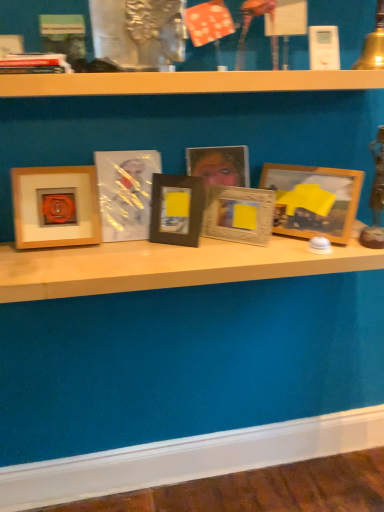
Question: In terms of width, does wooden picture frame at center, the 2th picture frame when ordered from right to left, look wider or thinner when compared to black matte picture frame at center, which ranks as the third picture frame in left-to-right order?

Choices:
 (A) wide
 (B) thin

Answer: (B)

Question: Would you say wooden picture frame at center, the 2th picture frame when ordered from right to left, is inside or outside black matte picture frame at center, which is the 4th picture frame in right-to-left order?

Choices:
 (A) outside
 (B) inside

Answer: (A)

Question: Based on their relative distances, which object is nearer to the wooden picture frame at center, the 2th picture frame when ordered from right to left?

Choices:
 (A) wooden photo frame at center, the 3th picture frame in the right-to-left sequence
 (B) matte wood picture frame at left, the sixth picture frame when ordered from right to left
 (C) matte plastic picture frame at center, the fifth picture frame from the right
 (D) wooden shelf at center
 (E) wooden frame at center, which is the 6th picture frame in left-to-right order

Answer: (A)

Question: Estimate the real-world distances between objects in this image. Which object is closer to the wooden shelf at upper center?

Choices:
 (A) wooden frame at center, which is the 6th picture frame in left-to-right order
 (B) hardcover book at upper left
 (C) black matte picture frame at center, which ranks as the third picture frame in left-to-right order
 (D) matte wood picture frame at left, marked as the first picture frame in a left-to-right arrangement
 (E) wooden picture frame at center, the fifth picture frame from the left

Answer: (B)